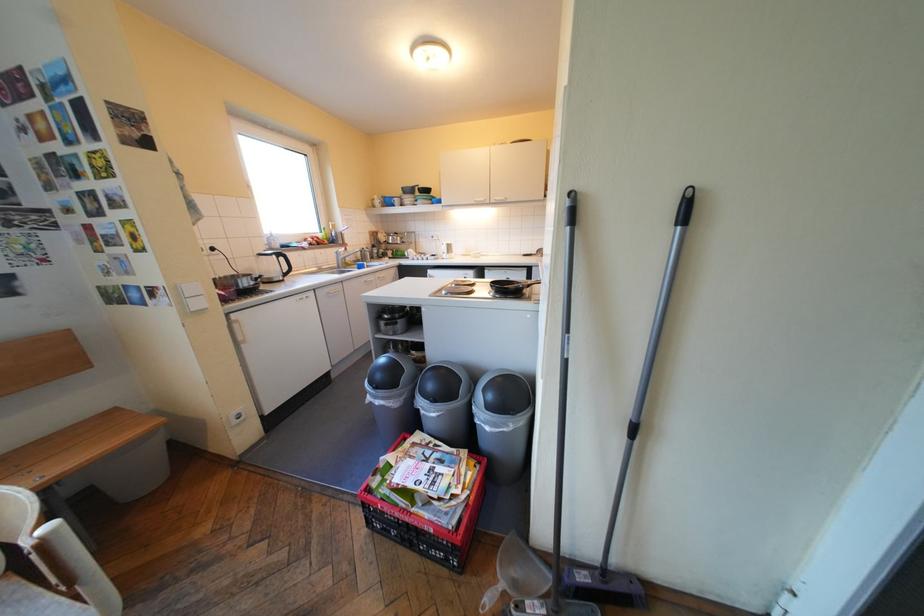
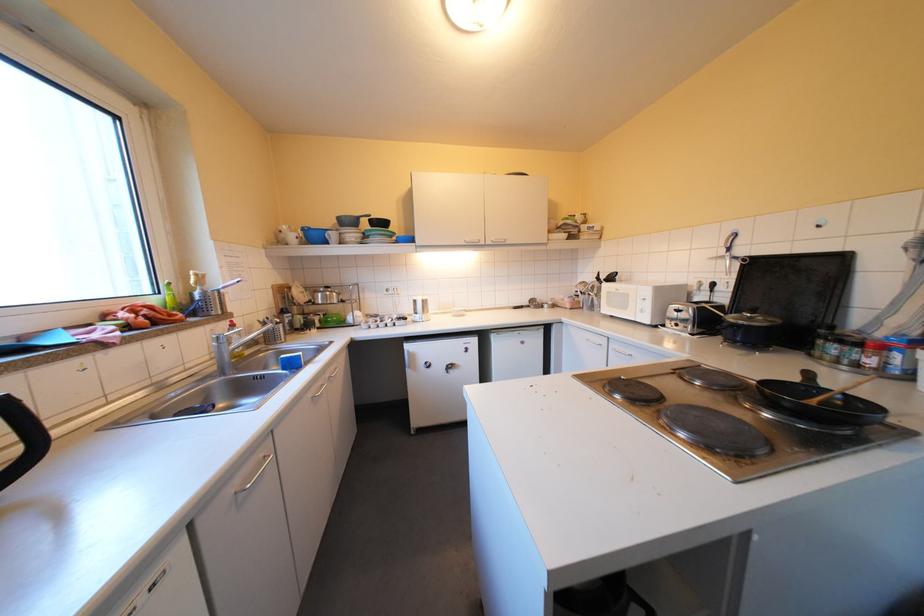
Locate, in the second image, the point that corresponds to point (334, 235) in the first image.

(167, 300)